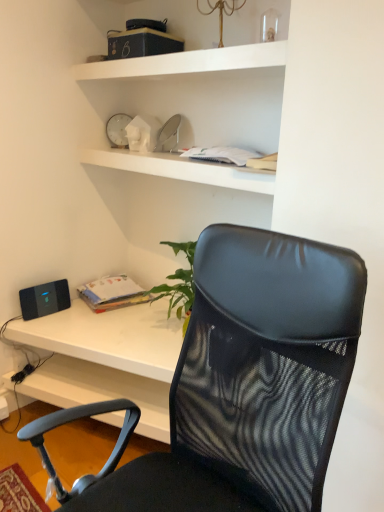
Image resolution: width=384 pixels, height=512 pixels. I want to click on free space on the front side of black matte speaker at lower left, so click(42, 323).